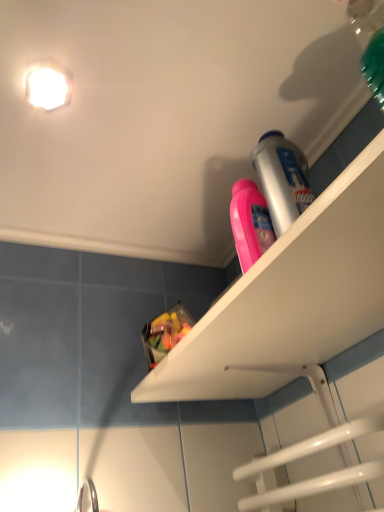
Describe the element at coordinates (290, 298) in the screenshot. Image resolution: width=384 pixels, height=512 pixels. I see `white plastic shelf at upper right` at that location.

Image resolution: width=384 pixels, height=512 pixels. I want to click on translucent plastic bag of candy at upper center, so click(165, 333).

Considering the points (368, 164) and (59, 91), which point is behind, point (368, 164) or point (59, 91)?

The point (59, 91) is behind.

Can you confirm if white plastic shelf at upper right is smaller than white glossy light fixture at upper left?

Actually, white plastic shelf at upper right might be larger than white glossy light fixture at upper left.

Looking at their sizes, would you say white plastic shelf at upper right is wider or thinner than white glossy light fixture at upper left?

In the image, white plastic shelf at upper right appears to be wider than white glossy light fixture at upper left.

I want to click on light fixture behind the white plastic shelf at upper right, so click(x=48, y=87).

Does point (37, 67) appear closer or farther from the camera than point (218, 399)?

Point (37, 67).

Does white glossy light fixture at upper left turn towards white plastic shelf at upper right?

No, white glossy light fixture at upper left is not turned towards white plastic shelf at upper right.

Between white glossy light fixture at upper left and white plastic shelf at upper right, which one has more height?

Standing taller between the two is white plastic shelf at upper right.

At what (x,y) coordinates should I click in order to perform the action: click on light fixture on the left of white plastic shelf at upper right. Please return your answer as a coordinate pair (x, y). This screenshot has width=384, height=512. Looking at the image, I should click on (48, 87).

From the image's perspective, does translucent plastic bag of candy at upper center appear higher than white plastic shelf at upper right?

Indeed, from the image's perspective, translucent plastic bag of candy at upper center is shown above white plastic shelf at upper right.

Can white plastic shelf at upper right be found inside translucent plastic bag of candy at upper center?

No, white plastic shelf at upper right is not surrounded by translucent plastic bag of candy at upper center.

Is translucent plastic bag of candy at upper center facing towards white plastic shelf at upper right?

No, translucent plastic bag of candy at upper center is not aimed at white plastic shelf at upper right.

Considering the positions of objects translucent plastic bag of candy at upper center and white plastic shelf at upper right in the image provided, who is in front, translucent plastic bag of candy at upper center or white plastic shelf at upper right?

white plastic shelf at upper right.

In terms of size, does white plastic shelf at upper right appear bigger or smaller than translucent plastic bag of candy at upper center?

In the image, white plastic shelf at upper right appears to be larger than translucent plastic bag of candy at upper center.

Based on the photo, from a real-world perspective, who is located lower, white plastic shelf at upper right or translucent plastic bag of candy at upper center?

In real-world perspective, white plastic shelf at upper right is lower.

Is white plastic shelf at upper right positioned beyond the bounds of translucent plastic bag of candy at upper center?

That's correct, white plastic shelf at upper right is outside of translucent plastic bag of candy at upper center.

From a real-world perspective, does translucent plastic bag of candy at upper center sit lower than white glossy light fixture at upper left?

Yes.

Is translucent plastic bag of candy at upper center positioned with its back to white glossy light fixture at upper left?

translucent plastic bag of candy at upper center does not have its back to white glossy light fixture at upper left.

Can you confirm if translucent plastic bag of candy at upper center is bigger than white glossy light fixture at upper left?

Correct, translucent plastic bag of candy at upper center is larger in size than white glossy light fixture at upper left.

In the scene shown: Is translucent plastic bag of candy at upper center not close to white glossy light fixture at upper left?

No, translucent plastic bag of candy at upper center is not far away from white glossy light fixture at upper left.

Between point (25, 94) and point (156, 349), which one is positioned behind?

Positioned behind is point (156, 349).

Considering the positions of objects white glossy light fixture at upper left and translucent plastic bag of candy at upper center in the image provided, who is in front, white glossy light fixture at upper left or translucent plastic bag of candy at upper center?

white glossy light fixture at upper left is in front.

Measure the distance between white glossy light fixture at upper left and translucent plastic bag of candy at upper center.

white glossy light fixture at upper left and translucent plastic bag of candy at upper center are 16.32 inches apart.

From the image's perspective, is white glossy light fixture at upper left located above or below translucent plastic bag of candy at upper center?

From the image's perspective, white glossy light fixture at upper left appears above translucent plastic bag of candy at upper center.

Locate an element on the screen. The height and width of the screenshot is (512, 384). light fixture above the white plastic shelf at upper right (from the image's perspective) is located at coordinates (48, 87).

Locate an element on the screen. shelf on the right side of white glossy light fixture at upper left is located at coordinates (290, 298).

When comparing their distances from white plastic shelf at upper right, does translucent plastic bag of candy at upper center or white glossy light fixture at upper left seem further?

white glossy light fixture at upper left lies further to white plastic shelf at upper right than the other object.

Based on their spatial positions, is white plastic shelf at upper right or white glossy light fixture at upper left further from translucent plastic bag of candy at upper center?

white glossy light fixture at upper left.

When comparing their distances from white plastic shelf at upper right, does white glossy light fixture at upper left or translucent plastic bag of candy at upper center seem further?

The object further to white plastic shelf at upper right is white glossy light fixture at upper left.

When comparing their distances from white glossy light fixture at upper left, does white plastic shelf at upper right or translucent plastic bag of candy at upper center seem further?

white plastic shelf at upper right.

Based on their spatial positions, is white glossy light fixture at upper left or white plastic shelf at upper right further from translucent plastic bag of candy at upper center?

Based on the image, white glossy light fixture at upper left appears to be further to translucent plastic bag of candy at upper center.

Looking at the image, which one is located closer to white glossy light fixture at upper left, translucent plastic bag of candy at upper center or white plastic shelf at upper right?

Based on the image, translucent plastic bag of candy at upper center appears to be nearer to white glossy light fixture at upper left.

In order to click on food between white glossy light fixture at upper left and white plastic shelf at upper right in the vertical direction in this screenshot , I will do 165,333.